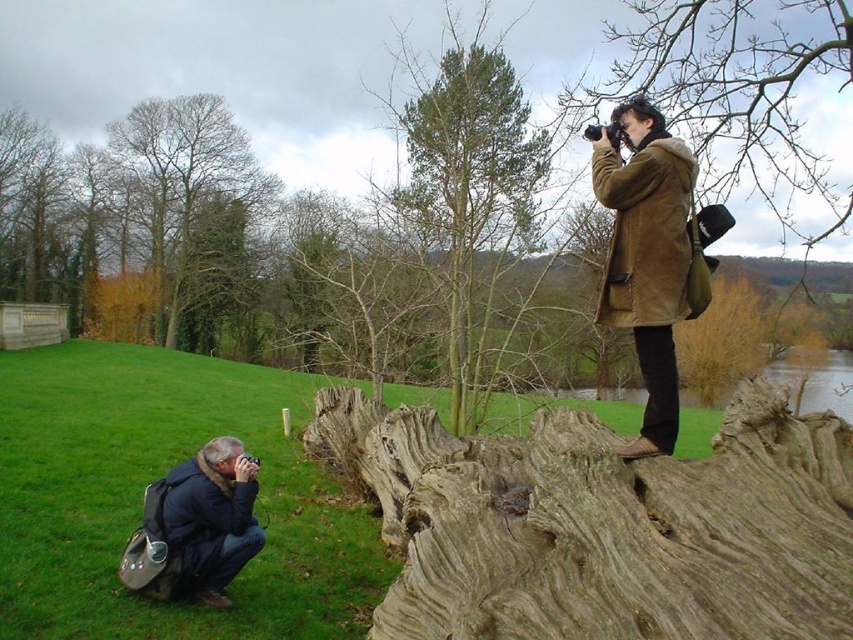
You are a photographer trying to capture a closeup of the intricate textures on the large weathered tree stump in the foreground. You have a brown suede coat at upper right and a dark blue fabric at lower left as backdrops. Which backdrop is closer to the tree stump?

The brown suede coat at upper right is closer to the tree stump because it is in front of the dark blue fabric at lower left.

You are a photographer standing at the edge of the grassy slope near the water. You notice two points marked in the scene. The first point is at coordinates point (647, 385) and the second is at point (247, 513). Which of these points is closer to you?

Point (647, 385) is in front of point (247, 513), so it is closer to you.